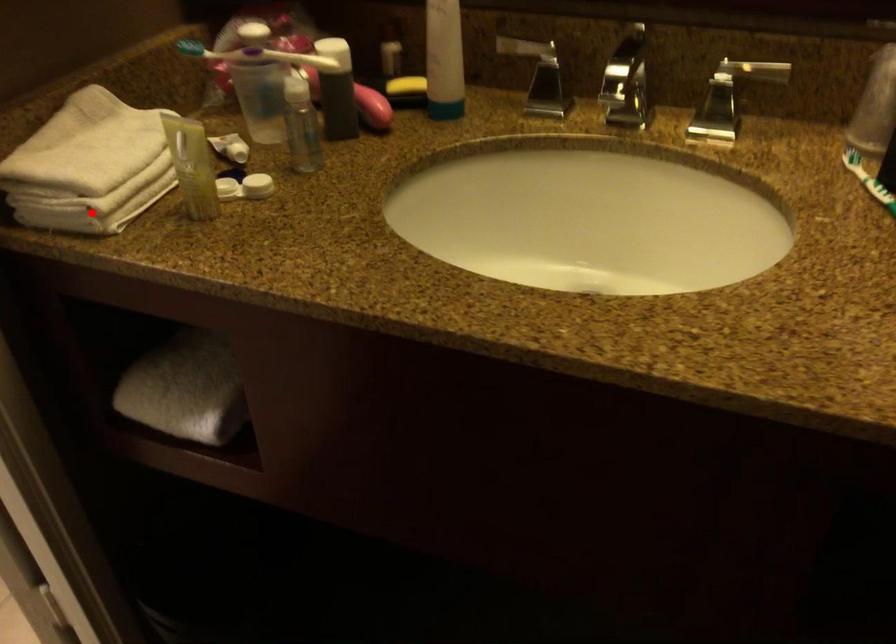
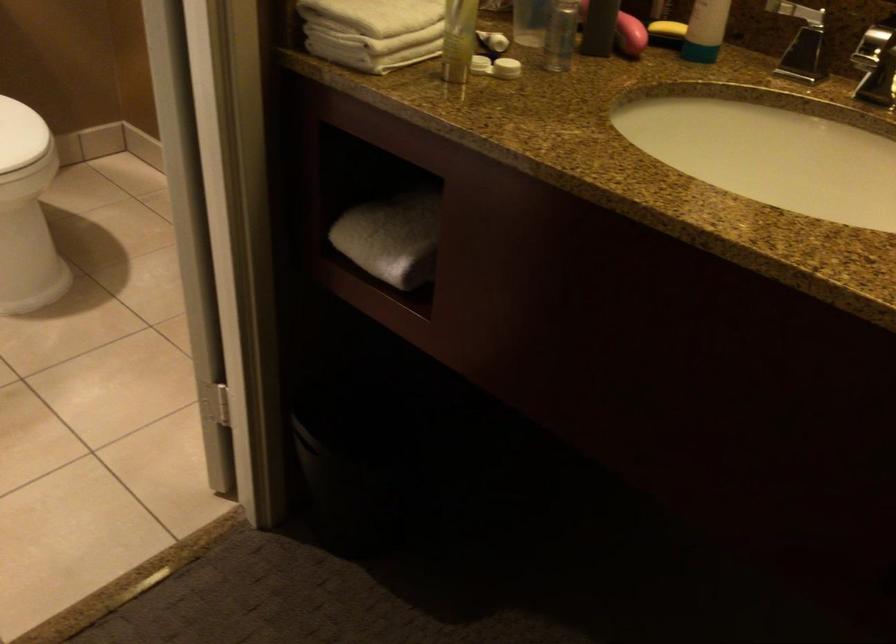
Question: I am providing you with two images of the same scene from different viewpoints. A red point is shown in image1. For the corresponding object point in image2, is it positioned nearer or farther from the camera?

Choices:
 (A) Nearer
 (B) Farther

Answer: (B)